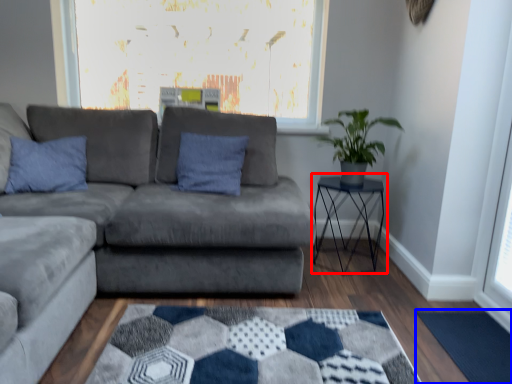
Question: Among these objects, which one is farthest to the camera, table (highlighted by a red box) or mat (highlighted by a blue box)?

Choices:
 (A) table
 (B) mat

Answer: (A)